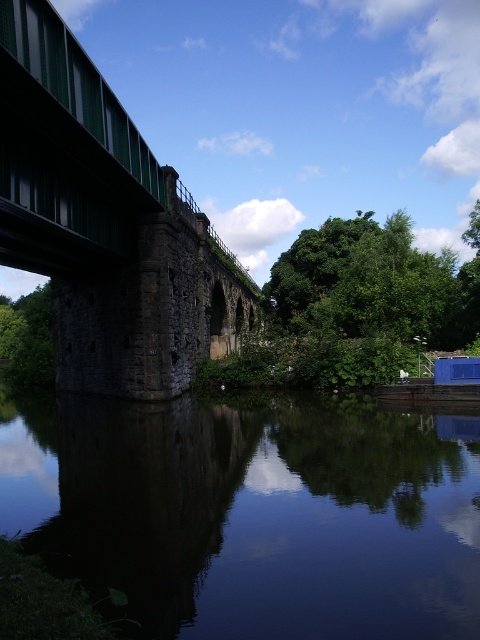
Does dark reflective water at lower center have a greater width compared to green leafy tree at lower left?

In fact, dark reflective water at lower center might be narrower than green leafy tree at lower left.

Is dark reflective water at lower center above green leafy tree at lower left?

No, dark reflective water at lower center is not above green leafy tree at lower left.

Measure the distance between dark reflective water at lower center and camera.

dark reflective water at lower center is 6.08 meters from camera.

Locate an element on the screen. This screenshot has width=480, height=640. dark reflective water at lower center is located at coordinates (251, 513).

Is dark reflective water at lower center positioned before green leafy tree at center?

Yes, it is in front of green leafy tree at center.

This screenshot has width=480, height=640. Describe the element at coordinates (251, 513) in the screenshot. I see `dark reflective water at lower center` at that location.

Is point (452, 621) positioned before point (304, 240)?

Yes, point (452, 621) is in front of point (304, 240).

Locate an element on the screen. The image size is (480, 640). dark reflective water at lower center is located at coordinates (251, 513).

Is point (43, 45) more distant than point (365, 317)?

No, (43, 45) is in front of (365, 317).

Can you confirm if green metallic bridge at left is positioned to the left of green leafy tree at center?

Indeed, green metallic bridge at left is positioned on the left side of green leafy tree at center.

This screenshot has width=480, height=640. Find the location of `green metallic bridge at left`. green metallic bridge at left is located at coordinates (105, 224).